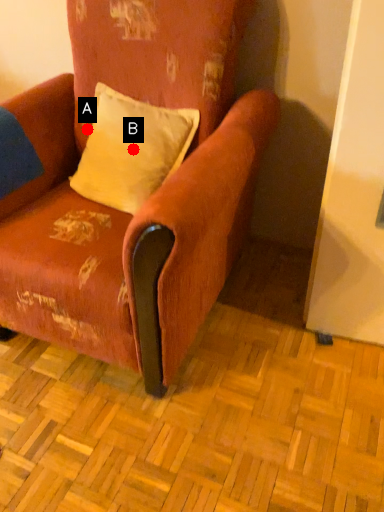
Question: Two points are circled on the image, labeled by A and B beside each circle. Which point is closer to the camera taking this photo?

Choices:
 (A) A is closer
 (B) B is closer

Answer: (B)